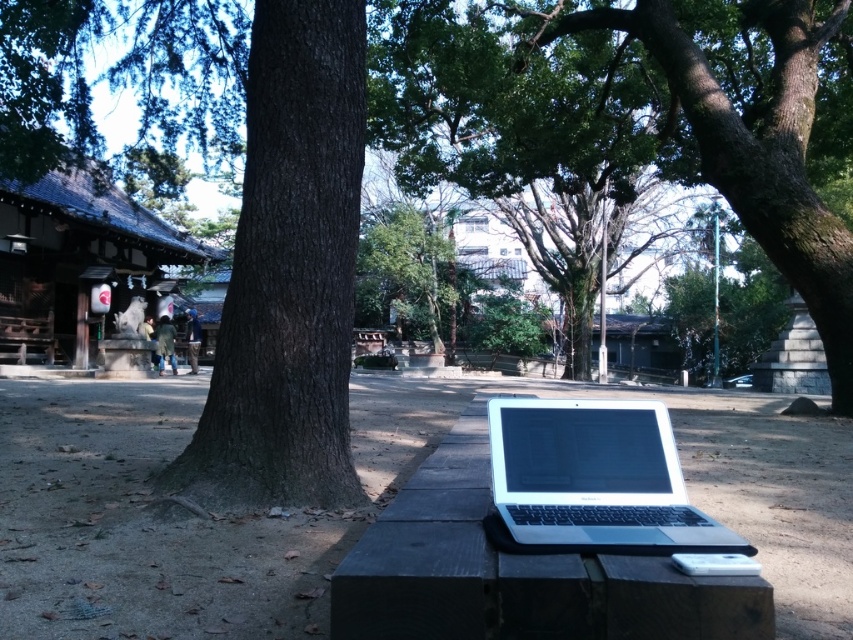
Question: Which point appears closest to the camera in this image?

Choices:
 (A) (407, 506)
 (B) (57, 180)

Answer: (A)

Question: Which object appears closest to the camera in this image?

Choices:
 (A) dark brown textured tree trunk at center
 (B) wooden hut at center
 (C) wooden bench at center
 (D) wooden shrine at left

Answer: (C)

Question: Is wooden bench at center wider than green leafy tree at center?

Choices:
 (A) yes
 (B) no

Answer: (B)

Question: Is wooden bench at center thinner than white glossy laptop at center?

Choices:
 (A) yes
 (B) no

Answer: (B)

Question: Estimate the real-world distances between objects in this image. Which object is closer to the wooden bench at center?

Choices:
 (A) wooden hut at center
 (B) dark brown textured tree trunk at center

Answer: (B)

Question: Where is dark brown textured tree trunk at center located in relation to wooden bench at center in the image?

Choices:
 (A) above
 (B) below

Answer: (A)